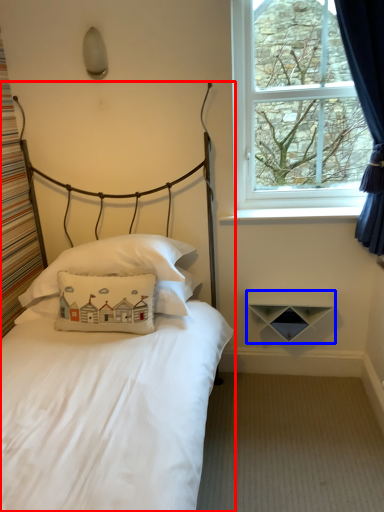
Question: Which object is further to the camera taking this photo, bed (highlighted by a red box) or shelf (highlighted by a blue box)?

Choices:
 (A) bed
 (B) shelf

Answer: (B)